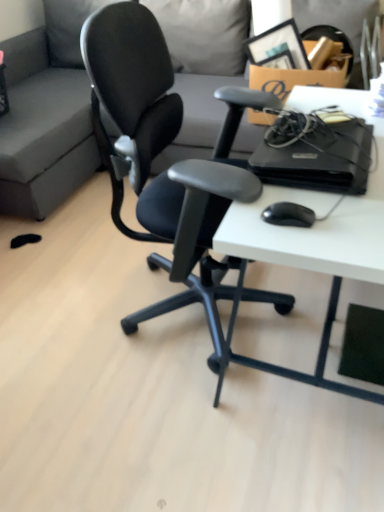
Question: From a real-world perspective, is cardboard box at upper right positioned above or below white matte desk at center?

Choices:
 (A) below
 (B) above

Answer: (B)

Question: From the image's perspective, is cardboard box at upper right positioned above or below white matte desk at center?

Choices:
 (A) above
 (B) below

Answer: (A)

Question: Which object is the closest to the cardboard box at upper right?

Choices:
 (A) black plastic computer at right
 (B) black matte mouse at lower right
 (C) gray fabric couch at upper center
 (D) white matte desk at center

Answer: (D)

Question: Which object is positioned farthest from the black plastic computer at right?

Choices:
 (A) white matte desk at center
 (B) black matte mouse at lower right
 (C) cardboard box at upper right
 (D) gray fabric couch at upper center

Answer: (D)